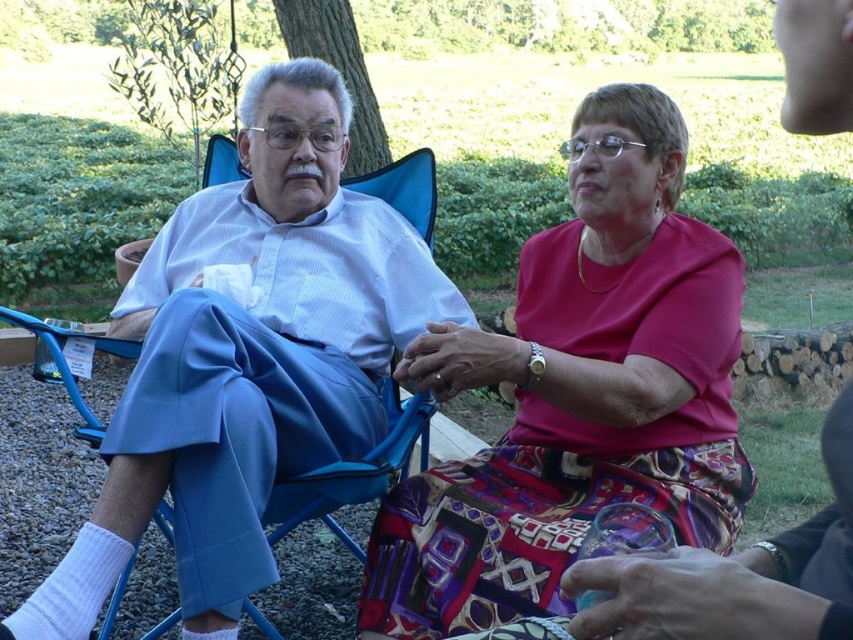
Who is positioned more to the left, matte pink blouse at center or matte blue pants at left?

matte blue pants at left is more to the left.

Between matte pink blouse at center and matte blue pants at left, which one has less height?

With less height is matte pink blouse at center.

The height and width of the screenshot is (640, 853). I want to click on matte pink blouse at center, so click(577, 392).

Find the location of `matte pink blouse at center`. matte pink blouse at center is located at coordinates (577, 392).